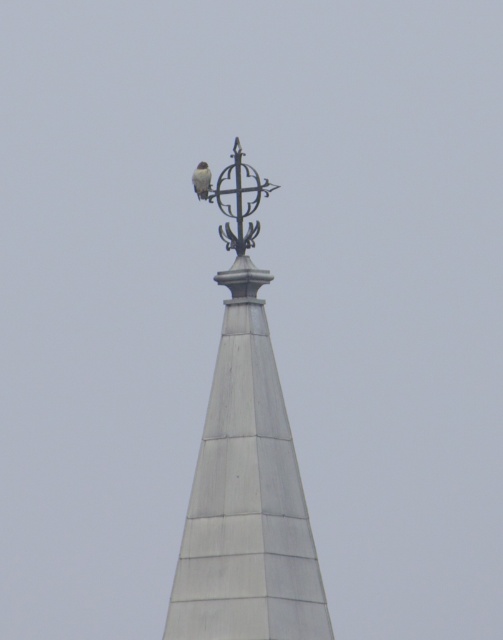
You are a birdwatcher trying to photograph the white feathered bird at upper center perched on the white matte spire at upper center. Since both are white, will the bird be easy to spot against the spire?

The white matte spire at upper center is taller than the white feathered bird at upper center, but since both are white, the bird may still be difficult to see against the spire due to similar coloration.